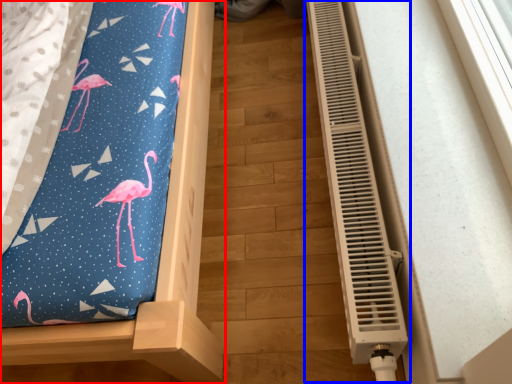
Question: Which object is closer to the camera taking this photo, furniture (highlighted by a red box) or air conditioning (highlighted by a blue box)?

Choices:
 (A) furniture
 (B) air conditioning

Answer: (A)